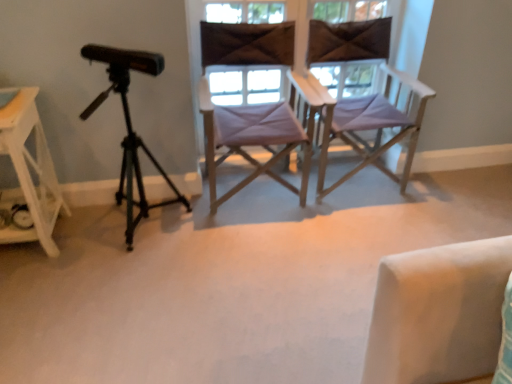
Question: Looking at the image, does brown fabric at center, arranged as the 1th window when viewed from the left, seem bigger or smaller compared to matte purple chair at center, placed as the 2th window when sorted from left to right?

Choices:
 (A) small
 (B) big

Answer: (A)

Question: Is point (242, 8) positioned closer to the camera than point (264, 87)?

Choices:
 (A) farther
 (B) closer

Answer: (B)

Question: Which object is the closest to the purple fabric chair at center, which is the 2th chair from left to right?

Choices:
 (A) brown fabric at center, positioned as the second window in right-to-left order
 (B) matte purple chair at center, which ranks as the 1th window in right-to-left order
 (C) purple fabric chair at center, marked as the 2th chair in a right-to-left arrangement
 (D) black matte tripod at left
 (E) white wood side table at left

Answer: (B)

Question: Estimate the real-world distances between objects in this image. Which object is closer to the purple fabric chair at center, which is the 2th chair from left to right?

Choices:
 (A) purple fabric chair at center, marked as the 2th chair in a right-to-left arrangement
 (B) black matte tripod at left
 (C) white wood side table at left
 (D) matte purple chair at center, which ranks as the 1th window in right-to-left order
 (E) brown fabric at center, arranged as the 1th window when viewed from the left

Answer: (D)